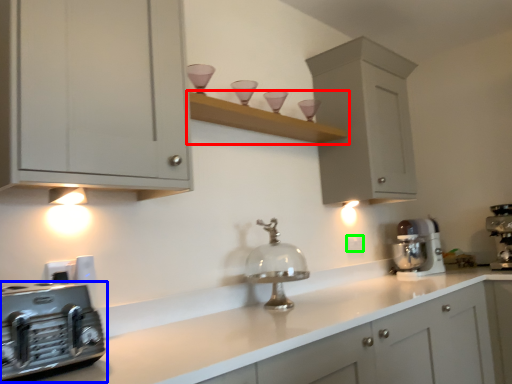
Question: Which object is the closest to the shelf (highlighted by a red box)? Choose among these: home appliance (highlighted by a blue box) or electric outlet (highlighted by a green box).

Choices:
 (A) home appliance
 (B) electric outlet

Answer: (B)